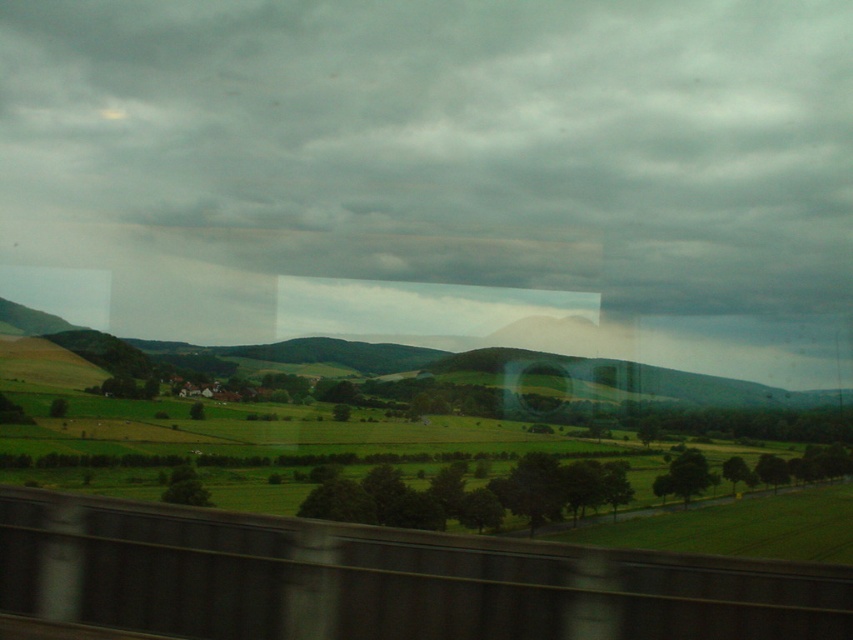
You are standing in a room with a window. You see a point at coordinates point (x=433, y=154). What does this point represent?

The point at coordinates point (x=433, y=154) represents the gray cloudy sky at upper center.

You are standing in a train compartment and looking through the window. You see the gray cloudy sky at upper center and the smooth concrete train track at bottom center. Which object is located higher in the scene?

The gray cloudy sky at upper center is located higher than the smooth concrete train track at bottom center in the scene.

You are standing in a room looking through a window. You see the gray cloudy sky at upper center and the smooth concrete train track at bottom center. Which object is closer to you?

The smooth concrete train track at bottom center is behind the gray cloudy sky at upper center, so the gray cloudy sky at upper center is closer to you.